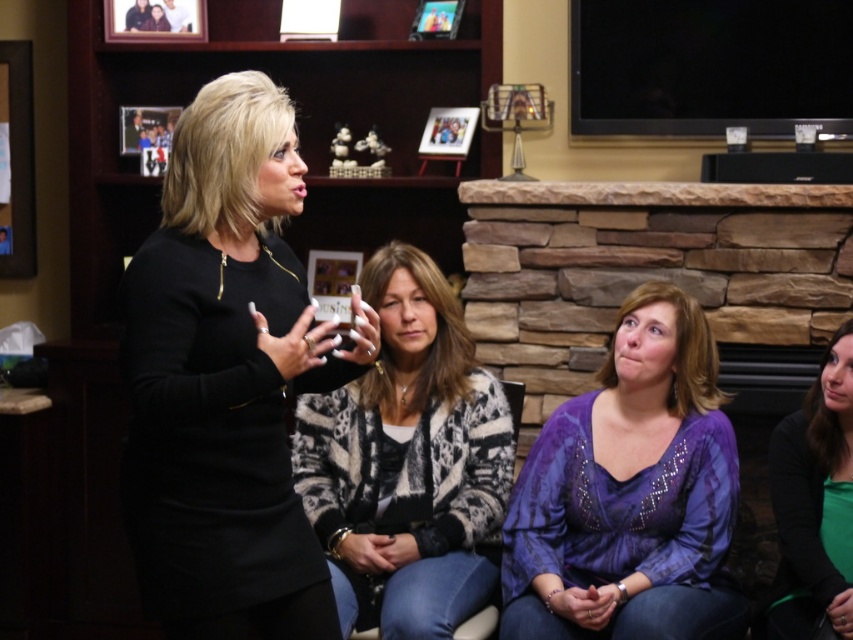
You are standing in the room where the women are seated. You need to locate the green matte shirt at lower right. Where exactly is it positioned in the room?

The green matte shirt at lower right is positioned at point (814,500) in the room.

You are a photographer setting up for a group photo. You need to ensure that the green matte shirt at lower right and the wooden picture frame at upper center are in focus simultaneously. Given that your camera can only maintain focus within a 5 feet range, will both objects be in focus?

The green matte shirt at lower right and wooden picture frame at upper center are 5.50 feet apart from each other. Since the distance between them exceeds the camera focus range of 5 feet, they cannot both be in focus at the same time.

You are a photographer standing 10 feet away from the black matte dress at center. You want to take a closeup photo of the dress without moving closer. Which camera zoom setting should you choose? The options are 50mm, 100mm, or 200mm.

The black matte dress at center is 10 feet away from you. To take a closeup photo without moving closer, you need a zoom lens with a focal length of at least 100mm. The 100mm or 200mm settings would work, but 100mm provides a balance between detail and natural perspective.